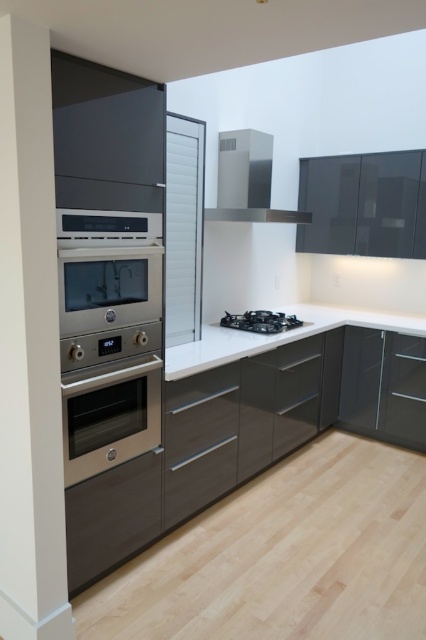
Question: Which point is closer to the camera taking this photo?

Choices:
 (A) (180, 348)
 (B) (106, 410)
 (C) (267, 321)

Answer: (B)

Question: In this image, where is stainless steel oven at center located relative to satin stainless steel exhaust hood at upper center?

Choices:
 (A) below
 (B) above

Answer: (A)

Question: Which of the following is the closest to the observer?

Choices:
 (A) (403, 332)
 (B) (249, 214)
 (C) (261, 314)
 (D) (112, 436)

Answer: (D)

Question: Does white glossy countertop at center appear over black matte stove at center?

Choices:
 (A) yes
 (B) no

Answer: (B)

Question: Which of these objects is positioned closest to the satin stainless steel exhaust hood at upper center?

Choices:
 (A) white glossy countertop at center
 (B) stainless steel oven at center

Answer: (A)

Question: Does stainless steel oven at center have a larger size compared to black matte stove at center?

Choices:
 (A) no
 (B) yes

Answer: (B)